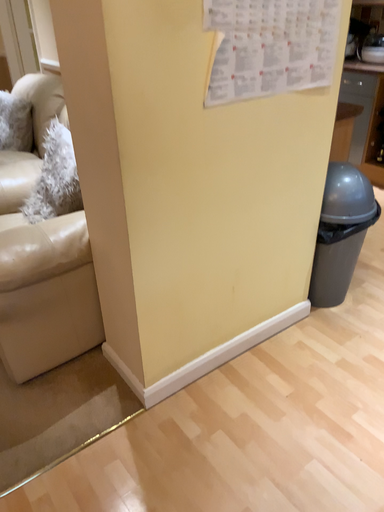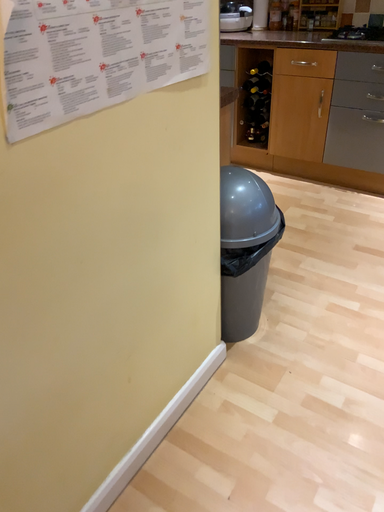
Question: Which way did the camera rotate in the video?

Choices:
 (A) rotated left
 (B) rotated right

Answer: (B)